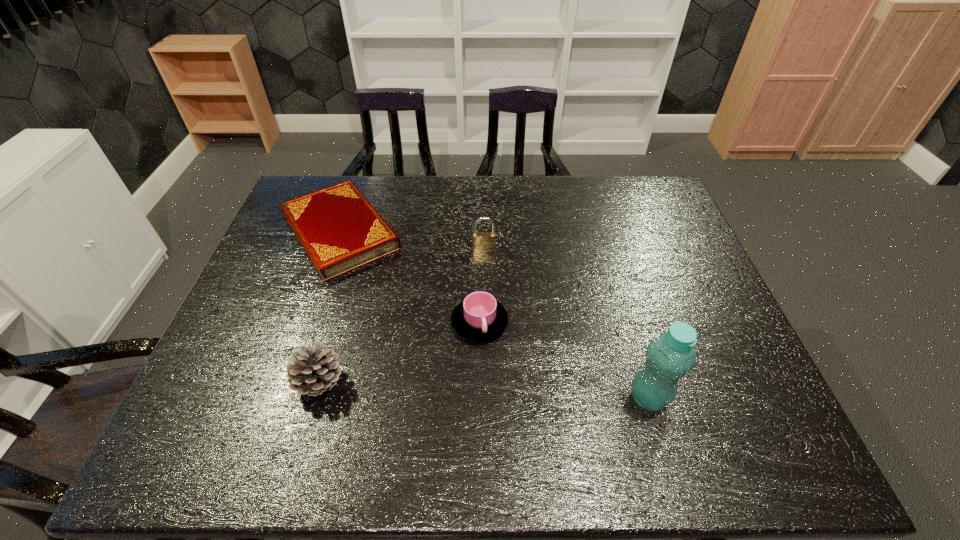
Identify the location of free space located 0.250m on the cover of the shortest object. (408, 331).

At what (x,y) coordinates should I click in order to perform the action: click on free point located on the front-facing side of the padlock. Please return your answer as a coordinate pair (x, y). Looking at the image, I should click on (484, 297).

Where is `blank space located 0.350m on the front-facing side of the padlock`? Image resolution: width=960 pixels, height=540 pixels. blank space located 0.350m on the front-facing side of the padlock is located at coordinates (483, 349).

Identify the location of vacant space located on the front-facing side of the padlock. [484, 300].

Find the location of a particular element. vacant space located 0.140m on the side with the handle of the third farthest object is located at coordinates (523, 388).

You are a GUI agent. You are given a task and a screenshot of the screen. Output one action in this format:
    pyautogui.click(x=<x>, y=<y>)
    Task: Click on the vacant space located 0.130m on the side with the handle of the third farthest object
    The width and height of the screenshot is (960, 540).
    Given the screenshot: What is the action you would take?
    pyautogui.click(x=521, y=384)

Locate an element on the screen. Image resolution: width=960 pixels, height=540 pixels. vacant space located on the side with the handle of the third farthest object is located at coordinates (526, 391).

The height and width of the screenshot is (540, 960). I want to click on object present at the far edge, so click(x=339, y=230).

This screenshot has height=540, width=960. In order to click on pinecone located at the near edge in this screenshot , I will do `click(312, 372)`.

The width and height of the screenshot is (960, 540). Find the location of `water bottle present at the near edge`. water bottle present at the near edge is located at coordinates (669, 357).